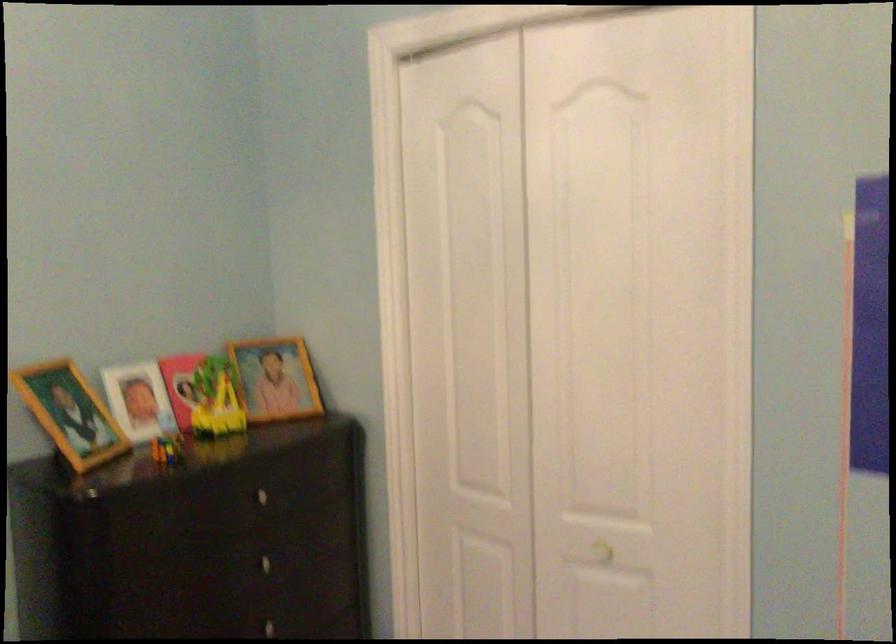
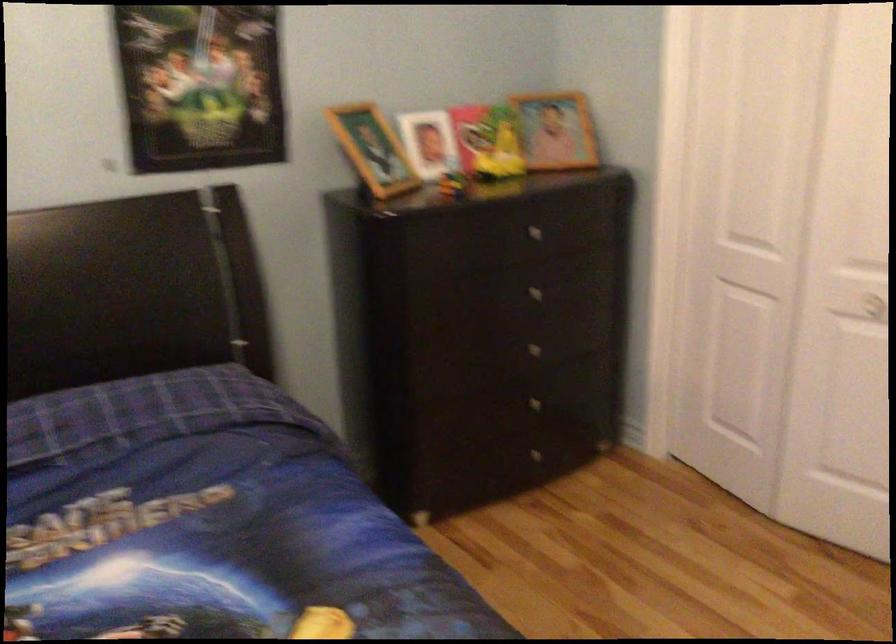
The point at (255, 498) is marked in the first image. Where is the corresponding point in the second image?

(530, 230)